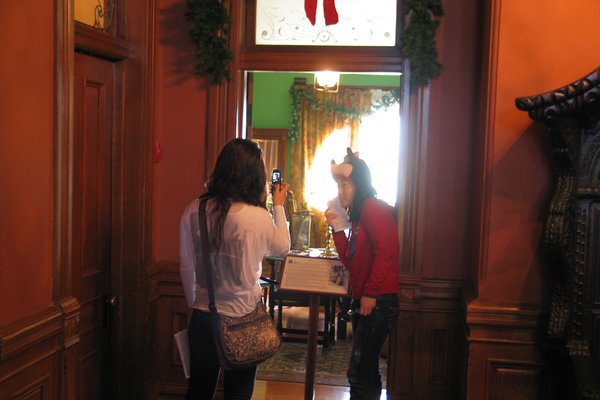
The image size is (600, 400). In order to click on green wall in this screenshot , I will do `click(262, 97)`.